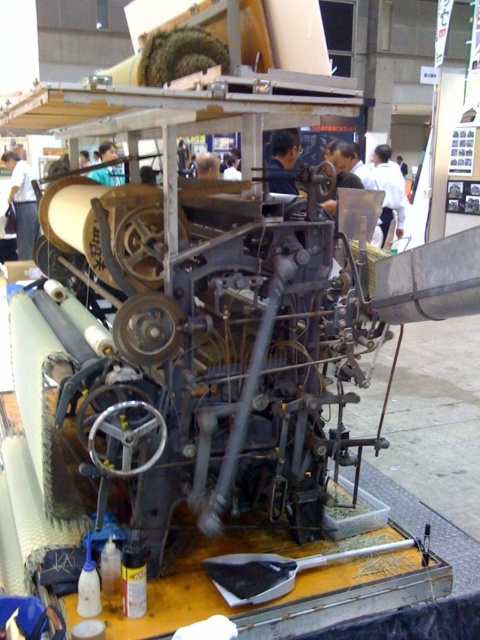
Does white fabric at center have a greater height compared to dark brown hair at center?

Yes.

Is white fabric at center to the left of dark brown hair at center from the viewer's perspective?

No, white fabric at center is not to the left of dark brown hair at center.

Between point (385, 196) and point (213, 173), which one is positioned behind?

The point (385, 196) is behind.

The width and height of the screenshot is (480, 640). I want to click on white fabric at center, so pos(388,189).

Can you confirm if dark blue shirt at center is shorter than dark brown hair at center?

No, dark blue shirt at center is not shorter than dark brown hair at center.

Between point (271, 152) and point (214, 156), which one is positioned in front?

Point (271, 152) is in front.

Where is `dark blue shirt at center`? The image size is (480, 640). dark blue shirt at center is located at coordinates (283, 148).

Can you confirm if white fabric at center is bigger than blue fabric at center?

Indeed, white fabric at center has a larger size compared to blue fabric at center.

Is point (398, 180) positioned behind point (115, 179)?

That is True.

Measure the distance between point (384, 161) and camera.

Point (384, 161) and camera are 8.37 meters apart from each other.

Identify the location of white fabric at center. The image size is (480, 640). (388, 189).